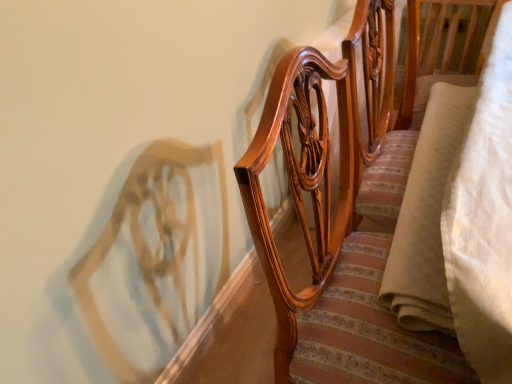
This screenshot has width=512, height=384. Find the location of `free space above beige suede blanket at right (from a real-world perspective)`. free space above beige suede blanket at right (from a real-world perspective) is located at coordinates (436, 177).